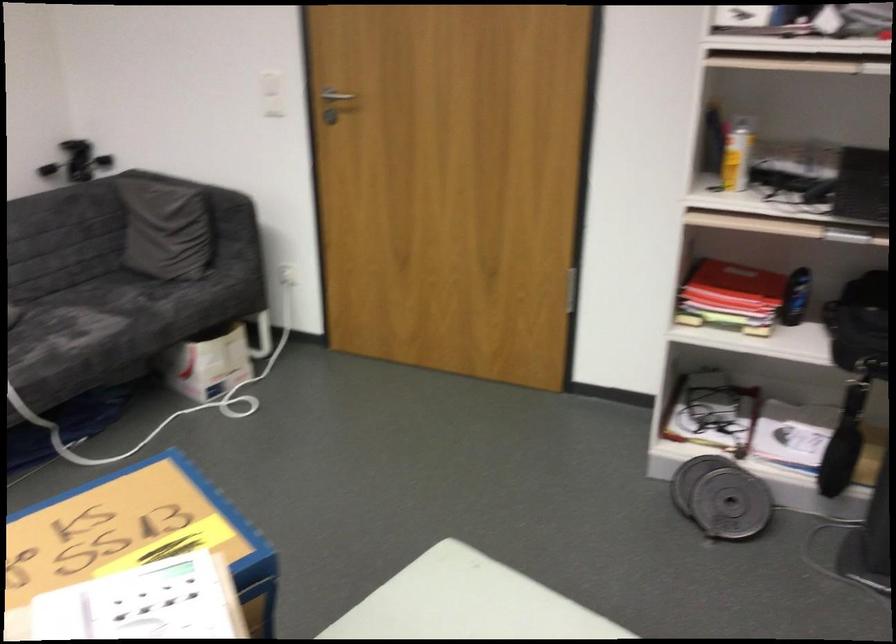
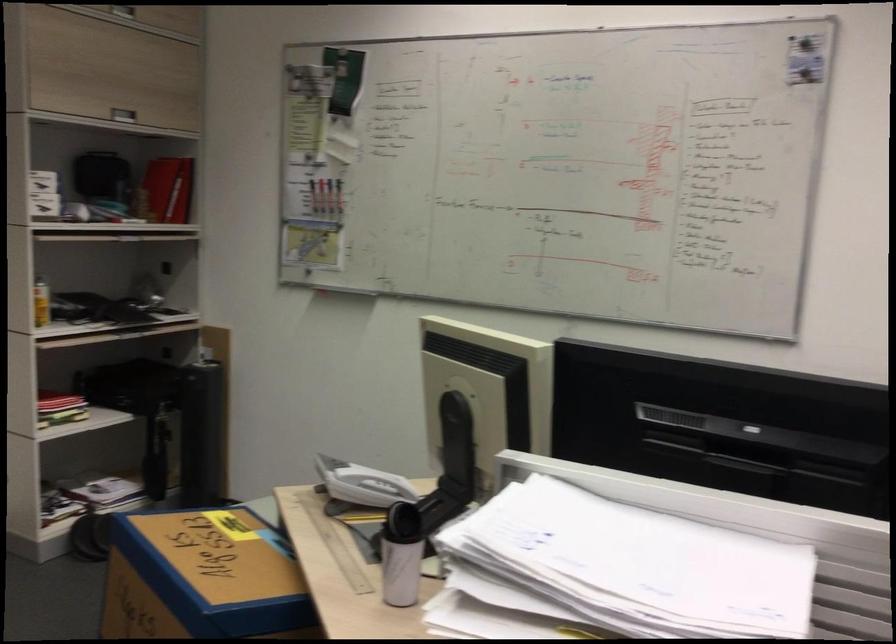
Locate, in the second image, the point that corresponds to (x=728, y=152) in the first image.

(40, 303)